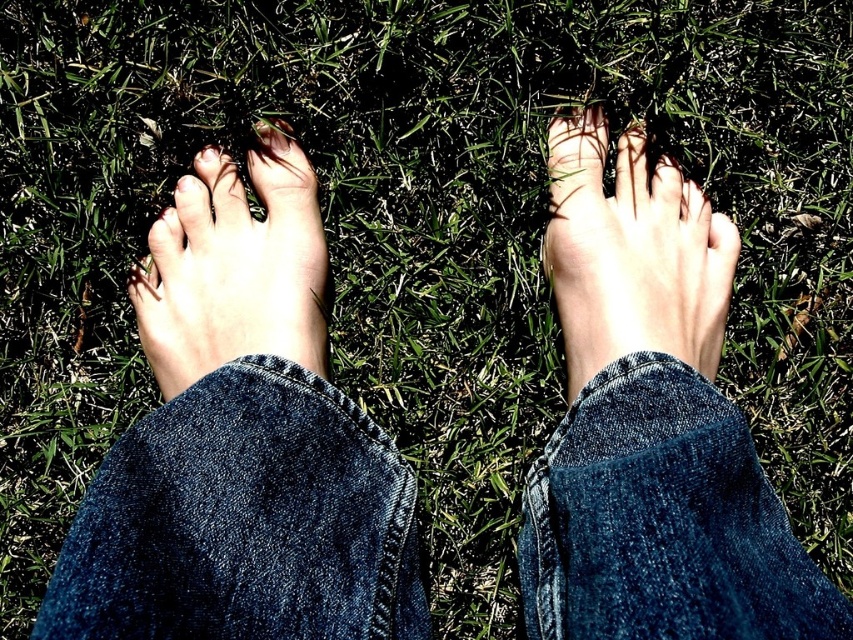
Does denim at center have a lesser height compared to natural skin tone foot at left?

Correct, denim at center is not as tall as natural skin tone foot at left.

Is denim at center to the left of natural skin tone foot at left from the viewer's perspective?

Incorrect, denim at center is not on the left side of natural skin tone foot at left.

Locate an element on the screen. The width and height of the screenshot is (853, 640). denim at center is located at coordinates (244, 520).

Consider the image. Which is more to the left, pale skin foot at center or natural skin tone foot at left?

Positioned to the left is natural skin tone foot at left.

Between pale skin foot at center and natural skin tone foot at left, which one is positioned higher?

Positioned higher is pale skin foot at center.

Does point (659, 326) lie in front of point (297, 310)?

Yes, point (659, 326) is closer to viewer.

Where is `pale skin foot at center`? The height and width of the screenshot is (640, 853). pale skin foot at center is located at coordinates (631, 253).

Between denim at center and pale skin foot at center, which one is positioned higher?

pale skin foot at center

In the scene shown: Does denim at center have a greater height compared to pale skin foot at center?

In fact, denim at center may be shorter than pale skin foot at center.

Is point (339, 573) positioned in front of point (608, 236)?

Yes.

This screenshot has width=853, height=640. I want to click on denim at center, so click(x=244, y=520).